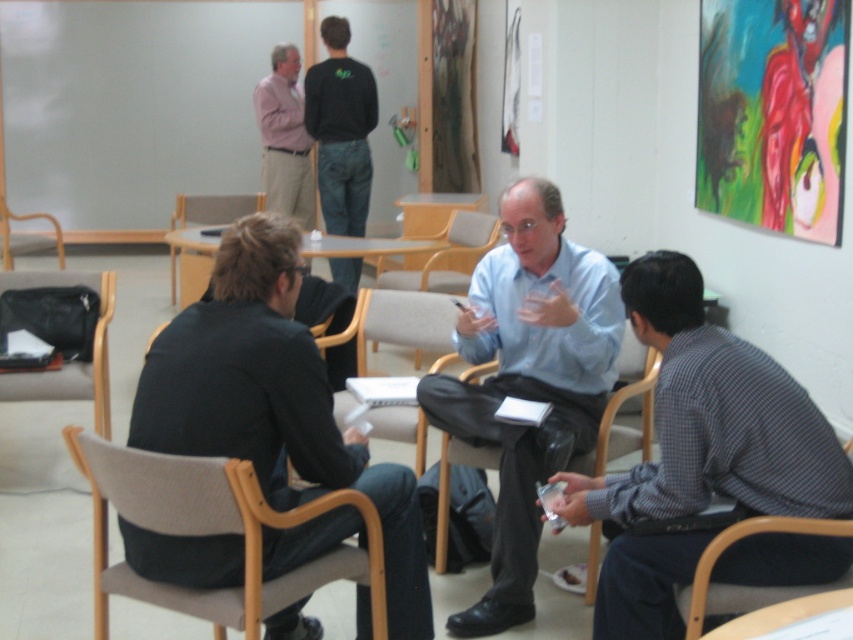
Question: Is the position of black leather chair at lower left more distant than that of light gray fabric chair at center?

Choices:
 (A) yes
 (B) no

Answer: (B)

Question: Which object appears closest to the camera in this image?

Choices:
 (A) matte pink shirt at upper left
 (B) wooden chair at lower right

Answer: (B)

Question: Considering the real-world distances, which object is closest to the light brown wood chair at left?

Choices:
 (A) light brown wood chair at center
 (B) light blue shirt at center

Answer: (A)

Question: Is light gray wood chair at center behind black leather chair at lower left?

Choices:
 (A) no
 (B) yes

Answer: (A)

Question: Does dark gray suit at center appear under beige fabric chair at lower left?

Choices:
 (A) no
 (B) yes

Answer: (A)

Question: Which of the following is the closest to the observer?

Choices:
 (A) light gray fabric chair at center
 (B) beige fabric chair at lower left
 (C) light brown wood chair at left

Answer: (B)